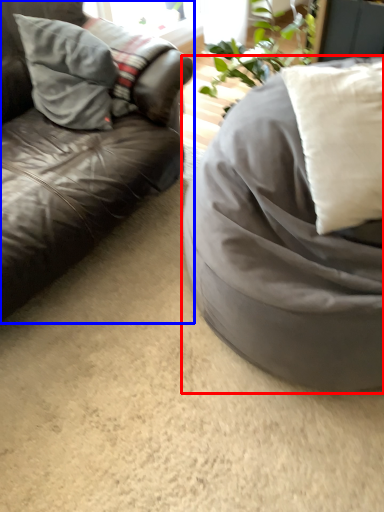
Question: Which object appears farthest to the camera in this image, furniture (highlighted by a red box) or studio couch (highlighted by a blue box)?

Choices:
 (A) furniture
 (B) studio couch

Answer: (B)